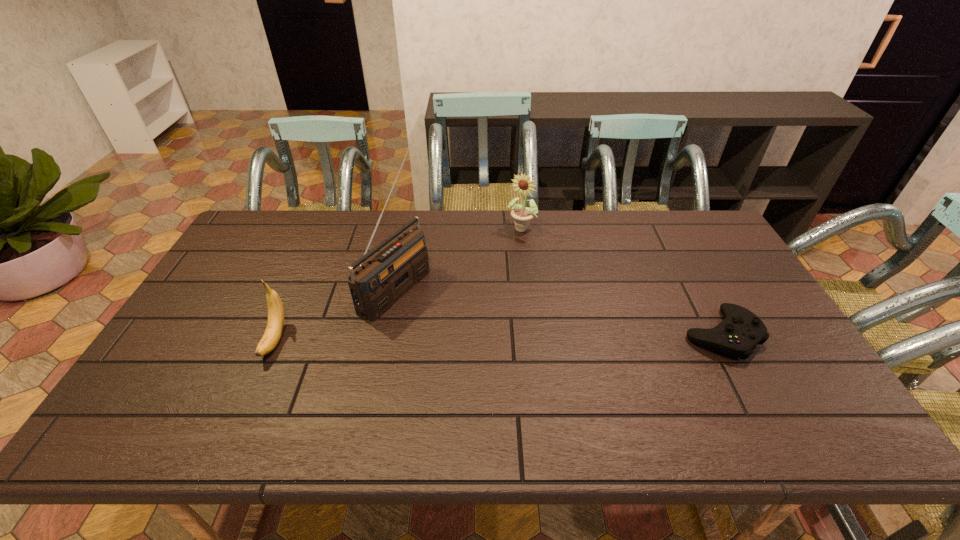
Select which object is the third closest to the second object from left to right. Please provide its 2D coordinates. Your answer should be formatted as a tuple, i.e. [(x, y)], where the tuple contains the x and y coordinates of a point satisfying the conditions above.

[(741, 330)]

You are a GUI agent. You are given a task and a screenshot of the screen. Output one action in this format:
    pyautogui.click(x=<x>, y=<y>)
    Task: Click on the vacant space that satisfies the following two spatial constraints: 1. on the front side of the rightmost object; 2. on the right side of the sunflower
    
    Given the screenshot: What is the action you would take?
    pyautogui.click(x=534, y=334)

Locate an element on the screen. vacant space that satisfies the following two spatial constraints: 1. on the front side of the second tallest object; 2. on the left side of the shortest object is located at coordinates (534, 334).